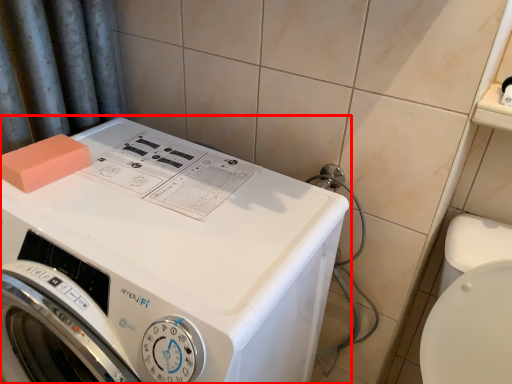
Question: From the image's perspective, what is the correct spatial relationship of washing machine (annotated by the red box) in relation to soap?

Choices:
 (A) above
 (B) below

Answer: (B)